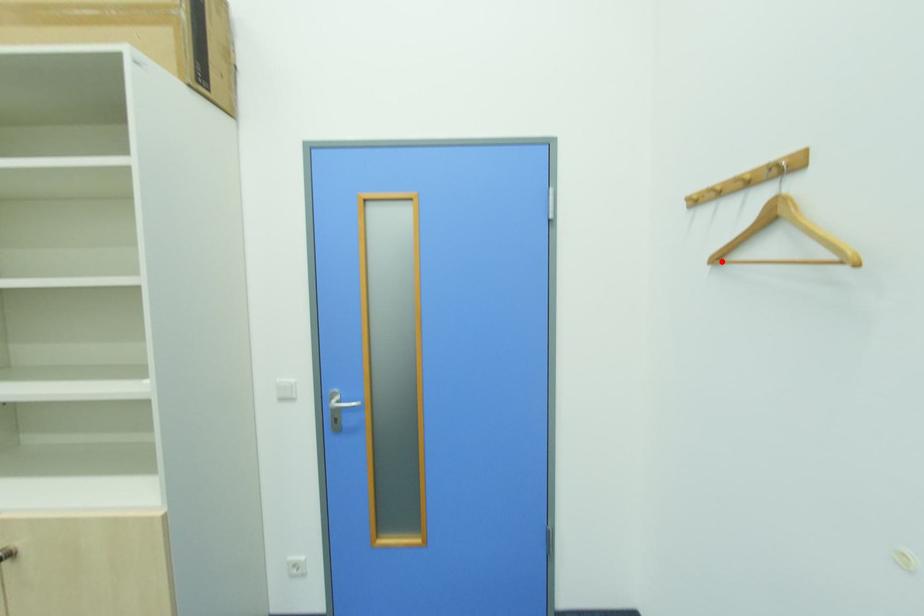
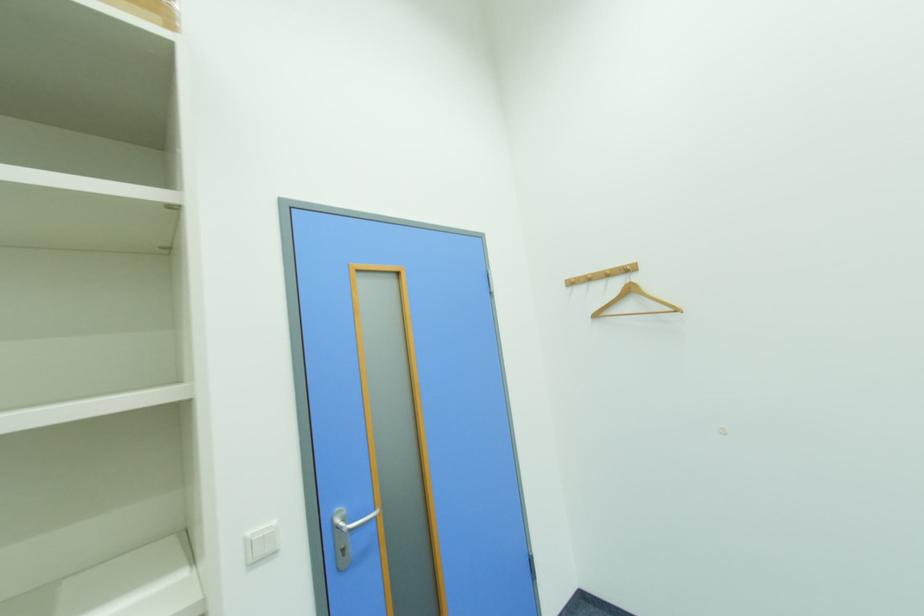
In the second image, find the point that corresponds to the highlighted location in the first image.

(601, 317)